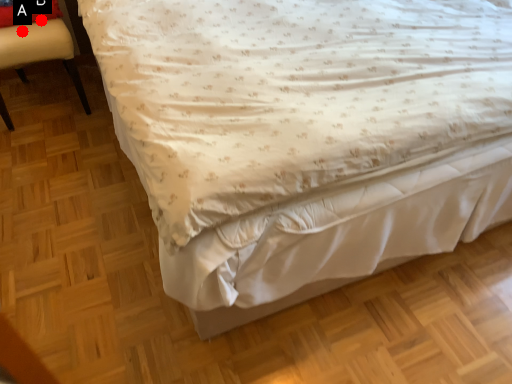
Question: Two points are circled on the image, labeled by A and B beside each circle. Which point is closer to the camera taking this photo?

Choices:
 (A) A is closer
 (B) B is closer

Answer: (A)